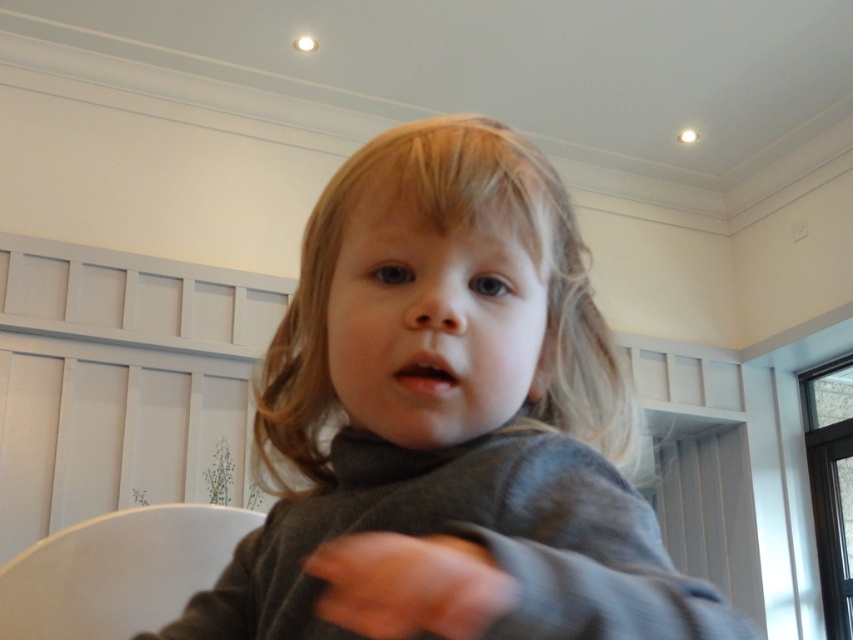
Question: Which of the following is the closest to the observer?

Choices:
 (A) smooth gray hand at center
 (B) white plastic chair at lower left
 (C) blonde silky hair at center

Answer: (A)

Question: Among these objects, which one is farthest from the camera?

Choices:
 (A) gray soft sweater at center
 (B) white plastic chair at lower left

Answer: (B)

Question: Does gray soft sweater at center have a lesser width compared to blonde silky hair at center?

Choices:
 (A) yes
 (B) no

Answer: (B)

Question: Which object appears farthest from the camera in this image?

Choices:
 (A) smooth gray hand at center
 (B) blonde silky hair at center
 (C) white plastic chair at lower left
 (D) gray soft sweater at center

Answer: (C)

Question: In this image, where is blonde silky hair at center located relative to smooth gray hand at center?

Choices:
 (A) below
 (B) above

Answer: (B)

Question: Can you confirm if gray soft sweater at center is thinner than smooth gray hand at center?

Choices:
 (A) no
 (B) yes

Answer: (A)